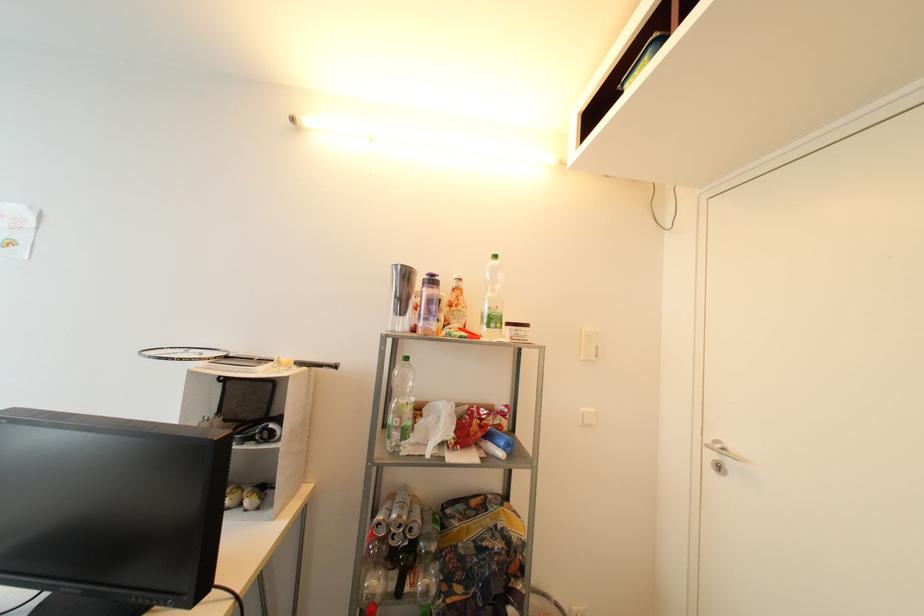
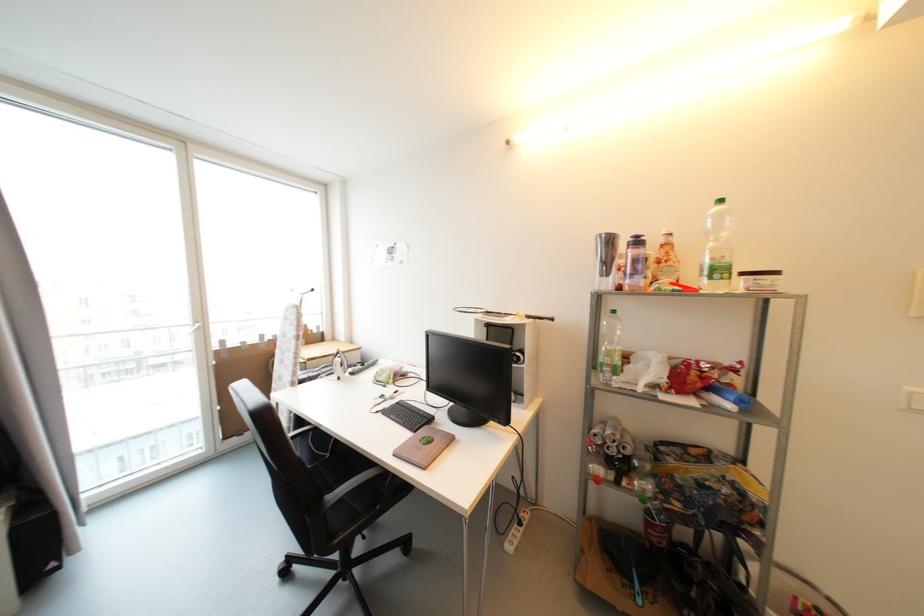
Question: Based on the continuous images, in which direction is the camera rotating? Reply with the corresponding letter.

Choices:
 (A) Left
 (B) Right
 (C) Up
 (D) Down

Answer: (A)